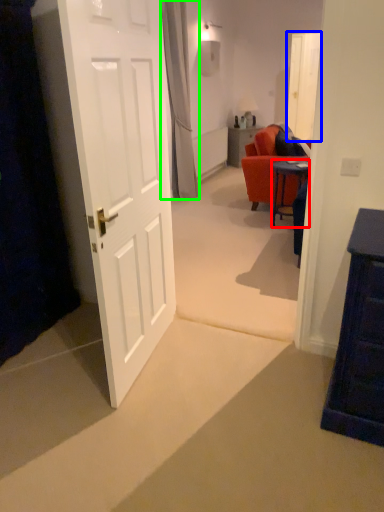
Question: Which object is positioned farthest from desk (highlighted by a red box)? Select from glass door (highlighted by a blue box) and curtain (highlighted by a green box).

Choices:
 (A) glass door
 (B) curtain

Answer: (A)